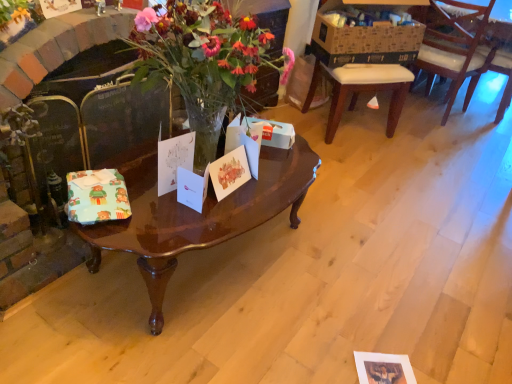
Question: Visually, is white paper gift card at center, acting as the second gift card starting from the left, positioned to the left or to the right of wooden chair at right?

Choices:
 (A) left
 (B) right

Answer: (A)

Question: Relative to wooden chair at right, is white paper gift card at center, acting as the second gift card starting from the left, in front or behind?

Choices:
 (A) behind
 (B) front

Answer: (B)

Question: Which object is the closest to the wooden chair at right?

Choices:
 (A) wooden chair at right
 (B) white paper gift card at center, arranged as the third gift card when viewed from the left
 (C) glossy wood coffee table at center
 (D) brightly colored paper at center, which is the 1th gift card in left-to-right order
 (E) white paper gift card at center, arranged as the third gift card when viewed from the right

Answer: (A)

Question: Estimate the real-world distances between objects in this image. Which object is farther from the wooden chair at right?

Choices:
 (A) glossy wood coffee table at center
 (B) wooden chair at right
 (C) brightly colored paper at center, positioned as the fourth gift card in right-to-left order
 (D) brown cardboard box at upper right
 (E) white paper gift card at center, which is counted as the 2th gift card, starting from the right

Answer: (C)